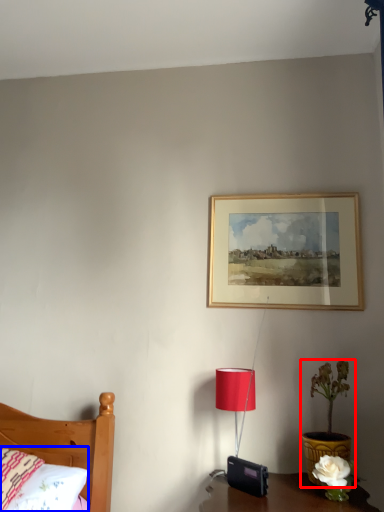
Question: Which object appears closest to the camera in this image, houseplant (highlighted by a red box) or pillow (highlighted by a blue box)?

Choices:
 (A) houseplant
 (B) pillow

Answer: (B)